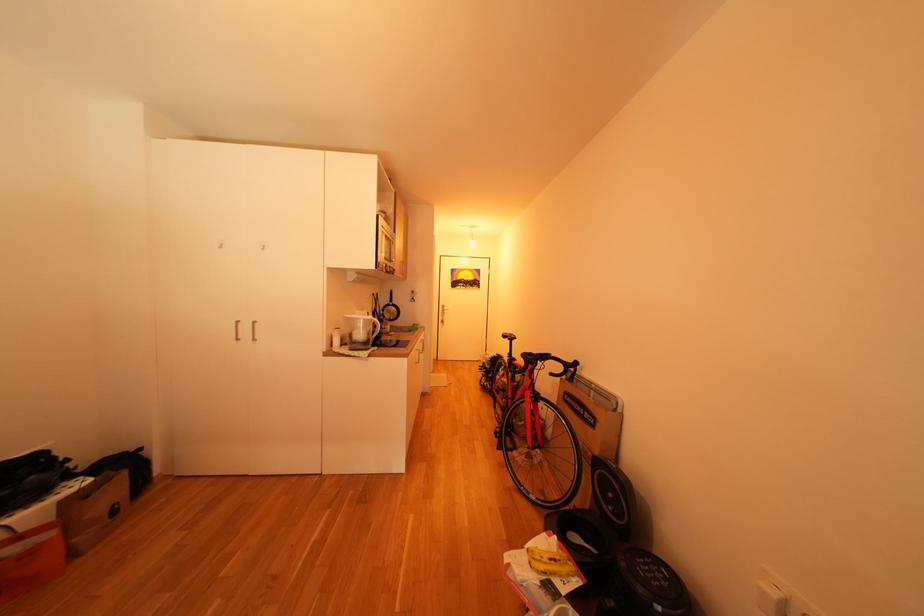
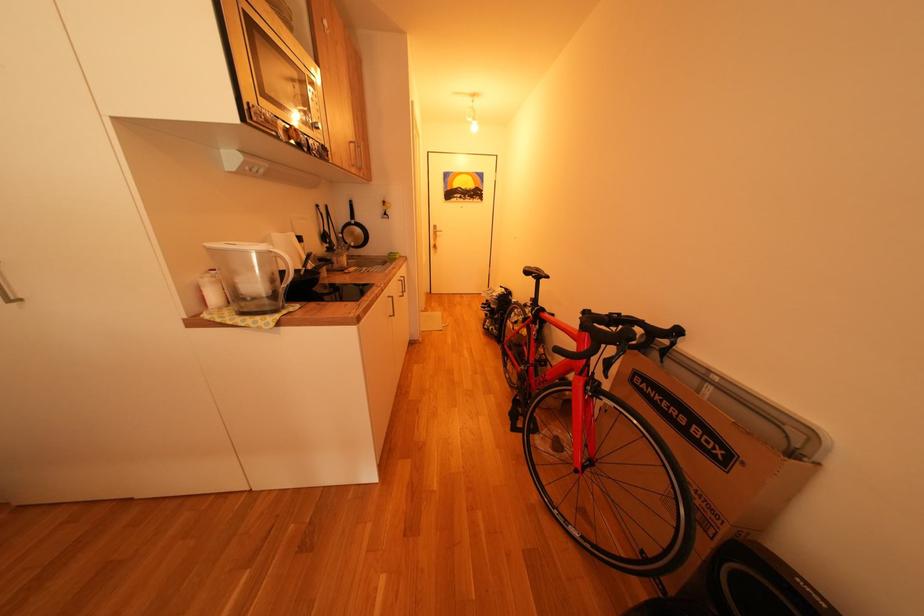
Question: In a continuous first-person perspective shot, in which direction is the camera moving?

Choices:
 (A) Left
 (B) Right
 (C) Forward
 (D) Backward

Answer: (C)